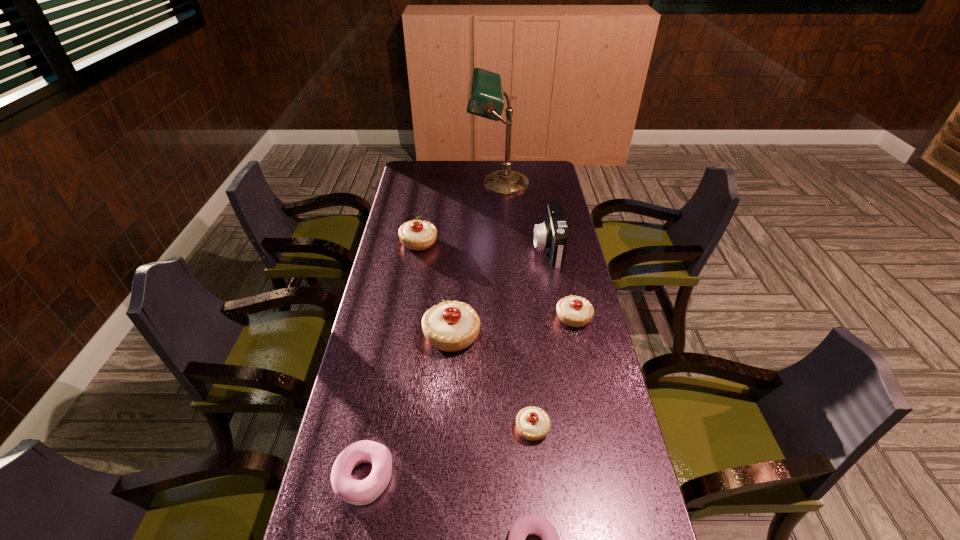
Locate an element on the screen. The image size is (960, 540). the farthest object is located at coordinates (485, 97).

Locate an element on the screen. table lamp is located at coordinates (485, 97).

At what (x,y) coordinates should I click in order to perform the action: click on camcorder. Please return your answer as a coordinate pair (x, y). The width and height of the screenshot is (960, 540). Looking at the image, I should click on (552, 235).

Where is `the biggest beige pastry`? the biggest beige pastry is located at coordinates (450, 326).

The width and height of the screenshot is (960, 540). In order to click on the second tallest pastry in this screenshot , I will do `click(416, 235)`.

The height and width of the screenshot is (540, 960). In order to click on the fourth tallest object in this screenshot , I will do `click(416, 235)`.

Locate an element on the screen. The height and width of the screenshot is (540, 960). the rightmost beige pastry is located at coordinates (573, 311).

The image size is (960, 540). What are the coordinates of `the rightmost pastry` in the screenshot? It's located at (573, 311).

The width and height of the screenshot is (960, 540). What are the coordinates of `the nearest beige pastry` in the screenshot? It's located at (532, 423).

Find the location of a particular element. The image size is (960, 540). the smallest beige pastry is located at coordinates 532,423.